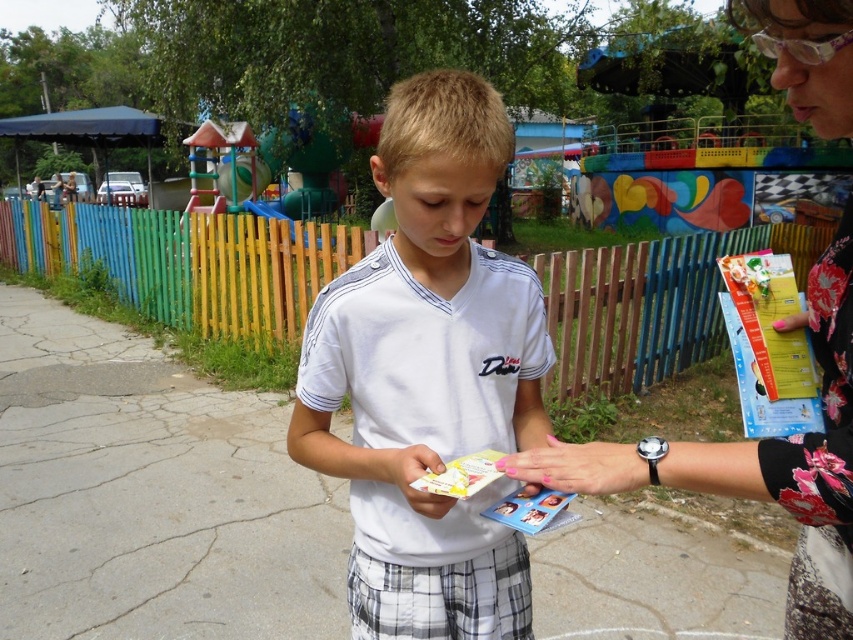
Question: Is white cotton shirt at center smaller than white matte paper at center?

Choices:
 (A) yes
 (B) no

Answer: (B)

Question: From the image, what is the correct spatial relationship of multicolored wooden fence at center in relation to floral fabric wristwatch at center?

Choices:
 (A) above
 (B) below

Answer: (A)

Question: Which of the following is the farthest from the observer?

Choices:
 (A) floral fabric wristwatch at center
 (B) pink painted nails at center
 (C) white matte paper at center

Answer: (C)

Question: Which object is the closest to the multicolored wooden fence at center?

Choices:
 (A) white cotton shirt at center
 (B) white matte paper at center
 (C) floral fabric wristwatch at center
 (D) pink painted nails at center

Answer: (C)

Question: Is white cotton shirt at center below multicolored wooden fence at center?

Choices:
 (A) yes
 (B) no

Answer: (A)

Question: Which is nearer to the floral fabric wristwatch at center?

Choices:
 (A) white cotton shirt at center
 (B) pink painted nails at center
 (C) white matte paper at center
 (D) multicolored wooden fence at center

Answer: (B)